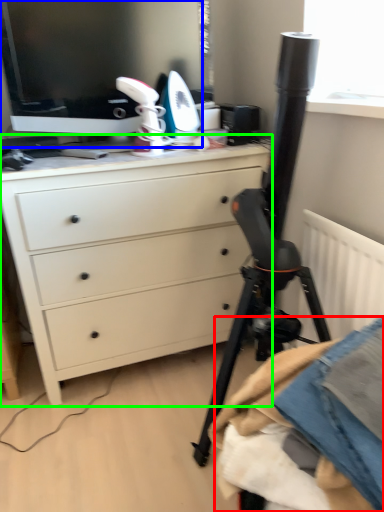
Question: Which object is positioned closest to clothing (highlighted by a red box)? Select from computer monitor (highlighted by a blue box) and chest of drawers (highlighted by a green box).

Choices:
 (A) computer monitor
 (B) chest of drawers

Answer: (B)